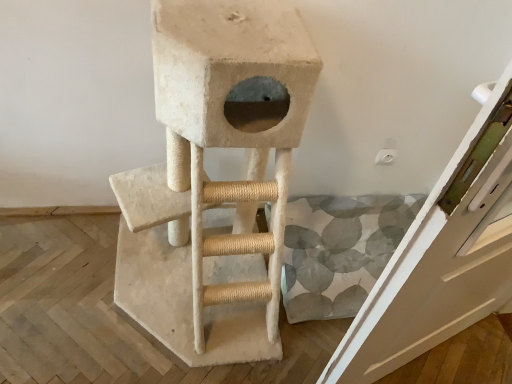
Measure the distance between point (236,243) and camera.

The depth of point (236,243) is 4.31 feet.

The width and height of the screenshot is (512, 384). What are the coordinates of `beige felt cat tree at center` in the screenshot? It's located at (214, 181).

What do you see at coordinates (214, 181) in the screenshot? I see `beige felt cat tree at center` at bounding box center [214, 181].

This screenshot has width=512, height=384. Find the location of `beige felt cat tree at center`. beige felt cat tree at center is located at coordinates (214, 181).